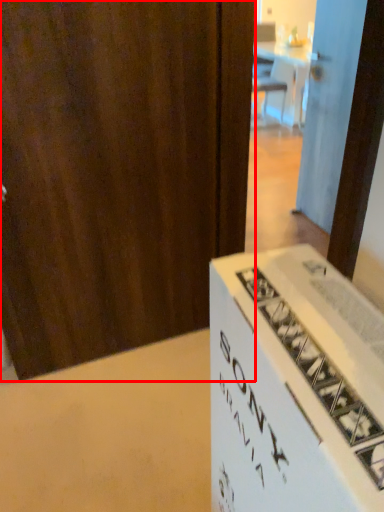
Question: From the image's perspective, where is door (annotated by the red box) located in relation to door in the image?

Choices:
 (A) above
 (B) below

Answer: (B)